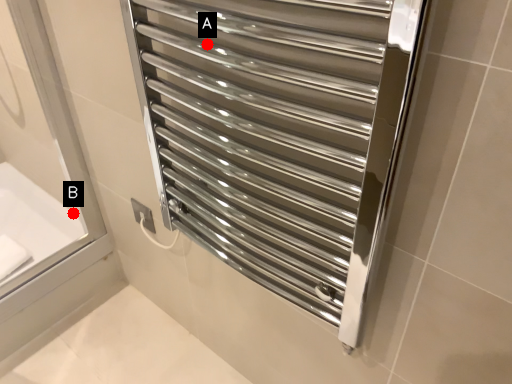
Question: Two points are circled on the image, labeled by A and B beside each circle. Which point appears closest to the camera in this image?

Choices:
 (A) A is closer
 (B) B is closer

Answer: (A)